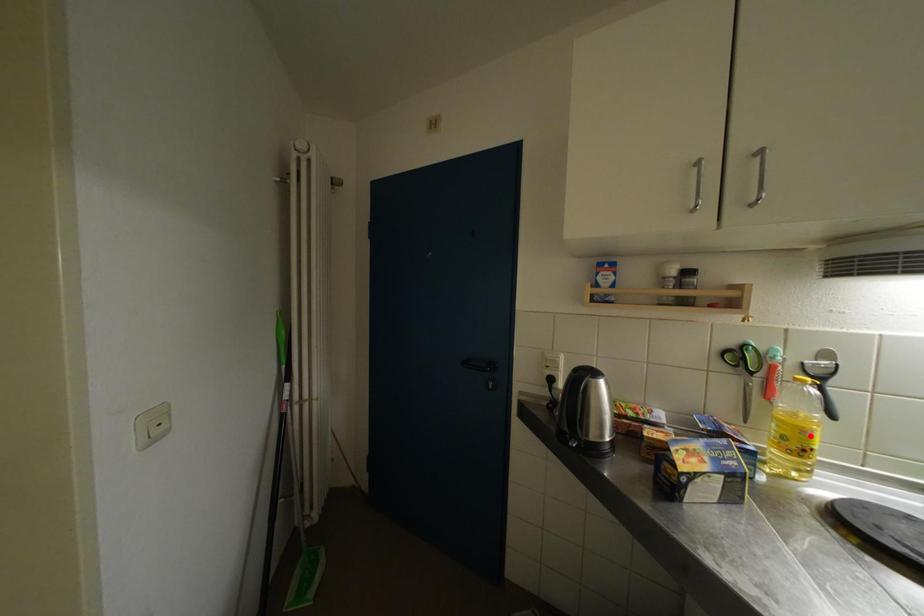
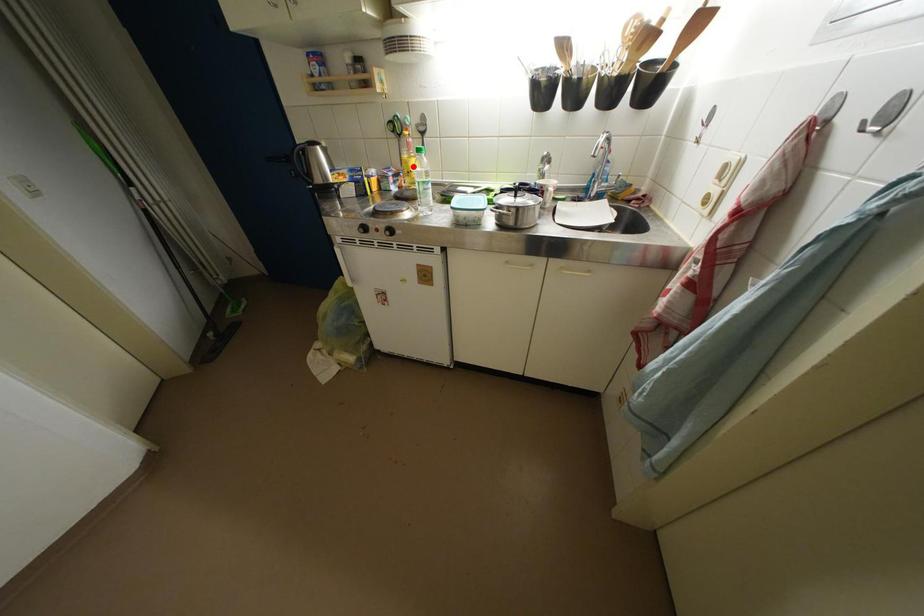
I am providing you with two images of the same scene from different viewpoints. A red point is marked on the first image and another point is marked on the second image. Are the points marked in image1 and image2 representing the same 3D position?

Yes